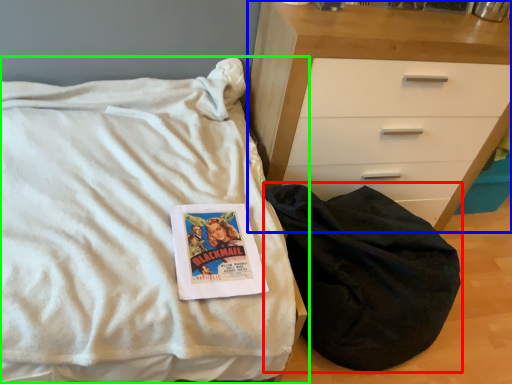
Question: Which object is the farthest from sleeping bag (highlighted by a red box)? Choose among these: chest of drawers (highlighted by a blue box) or bed (highlighted by a green box).

Choices:
 (A) chest of drawers
 (B) bed

Answer: (B)